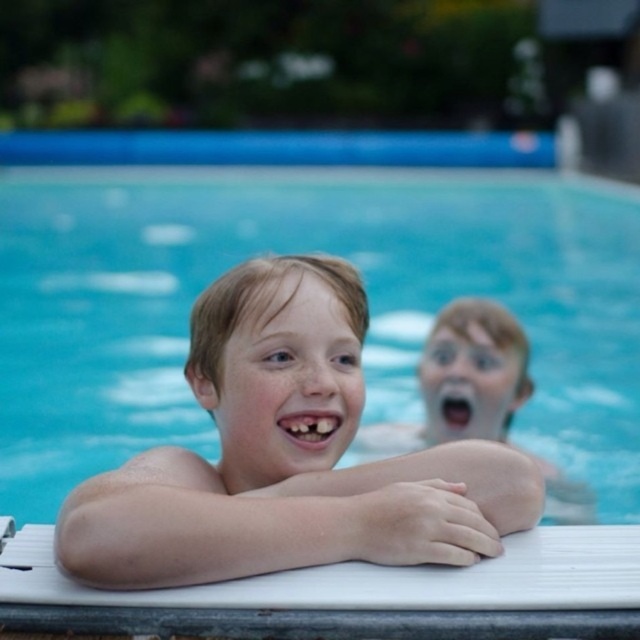
You are a lifeguard at the pool and need to determine if both children can fit side by side on a 1.8 meter wide floating platform. The smooth skin boy at center and the smooth skin child at center are both facing you. Based on their widths, can they fit?

The smooth skin boy at center is wider than the smooth skin child at center, but their combined widths must be less than or equal to 1.8 meters to fit. Without specific measurements, it is impossible to determine if they can fit side by side on the platform.

You are a photographer standing at the edge of the pool. You want to take a photo that includes both point (74, 557) and point (355, 436). Which point should you focus on first to ensure both are in focus?

You should focus on point (74, 557) first because it is closer to the viewer than point (355, 436). By focusing on the closer point, the farther point will also be within the depth of field and in focus.